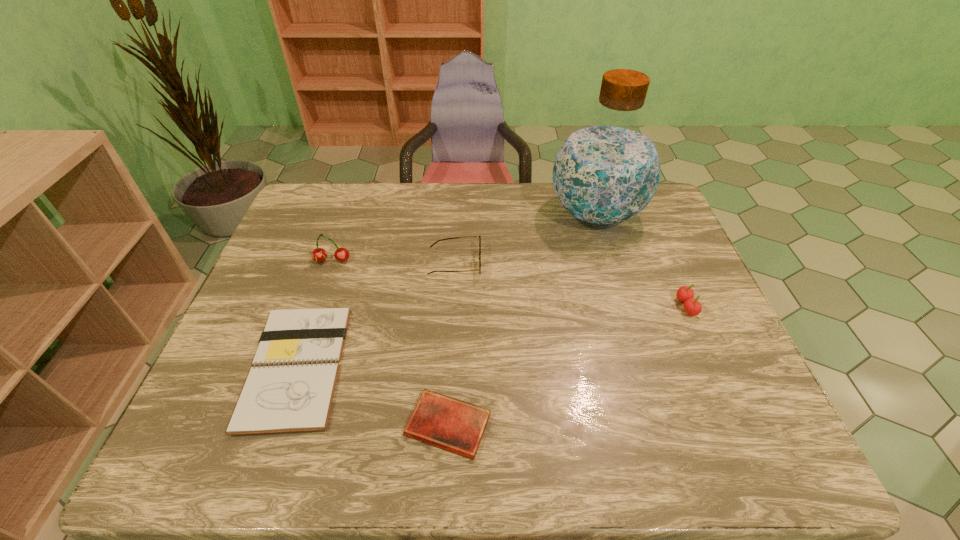
Identify the location of water jug. (606, 172).

Find the location of `the taller cherry`. the taller cherry is located at coordinates (319, 255).

The image size is (960, 540). What are the coordinates of `the fifth shortest object` in the screenshot? It's located at (319, 255).

This screenshot has height=540, width=960. What are the coordinates of `the shorter cherry` in the screenshot? It's located at (685, 294).

At what (x,y) coordinates should I click in order to perform the action: click on the third tallest object. Please return your answer as a coordinate pair (x, y). The width and height of the screenshot is (960, 540). Looking at the image, I should click on (685, 294).

Find the location of a particular element. the third shortest object is located at coordinates (479, 236).

Locate an element on the screen. The height and width of the screenshot is (540, 960). notepad is located at coordinates (290, 388).

This screenshot has width=960, height=540. Find the location of `diary`. diary is located at coordinates (454, 425).

Identify the location of vacant space located on the front of the water jug. This screenshot has height=540, width=960. (631, 329).

Locate an element on the screen. The width and height of the screenshot is (960, 540). free location located with stems pointing upwards on the farther cherry is located at coordinates (320, 298).